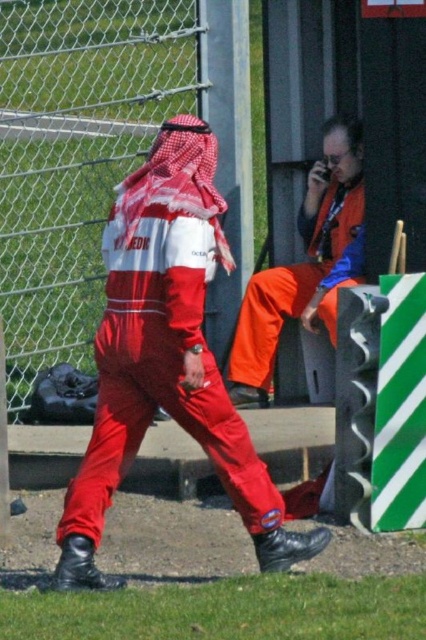
Question: Which of the following is the farthest from the observer?

Choices:
 (A) metallic chain-link fence at upper left
 (B) matte red jumpsuit at center
 (C) orange fabric pants at center

Answer: (A)

Question: Which point is farther to the camera?

Choices:
 (A) (267, 483)
 (B) (244, 396)
 (C) (89, 40)

Answer: (B)

Question: Does metallic chain-link fence at upper left have a larger size compared to matte red jumpsuit at center?

Choices:
 (A) no
 (B) yes

Answer: (B)

Question: Which object appears closest to the camera in this image?

Choices:
 (A) metallic chain-link fence at upper left
 (B) matte red jumpsuit at center

Answer: (B)

Question: Is metallic chain-link fence at upper left wider than matte red jumpsuit at center?

Choices:
 (A) no
 (B) yes

Answer: (A)

Question: From the image, what is the correct spatial relationship of metallic chain-link fence at upper left in relation to matte red jumpsuit at center?

Choices:
 (A) right
 (B) left

Answer: (B)